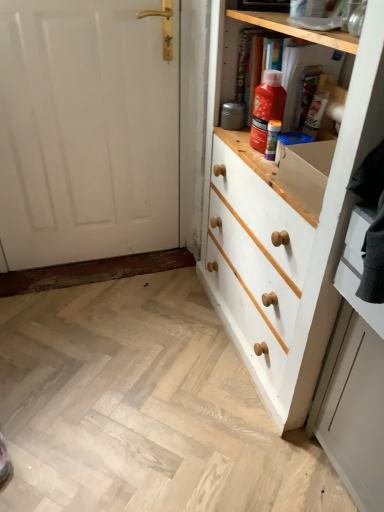
Question: Is white painted wood drawer at right spatially inside purple plastic tube at upper center, or outside of it?

Choices:
 (A) inside
 (B) outside

Answer: (B)

Question: Does point (352, 224) appear closer or farther from the camera than point (269, 120)?

Choices:
 (A) closer
 (B) farther

Answer: (A)

Question: Considering the real-world distances, which object is farthest from the white painted wood chest of drawers at right?

Choices:
 (A) white painted wood drawer at right
 (B) white painted wood door at left
 (C) purple plastic tube at upper center
 (D) matte orange plastic bottle at upper center

Answer: (B)

Question: Which is nearer to the white painted wood chest of drawers at right?

Choices:
 (A) matte orange plastic bottle at upper center
 (B) purple plastic tube at upper center
 (C) white painted wood door at left
 (D) white painted wood drawer at right

Answer: (D)